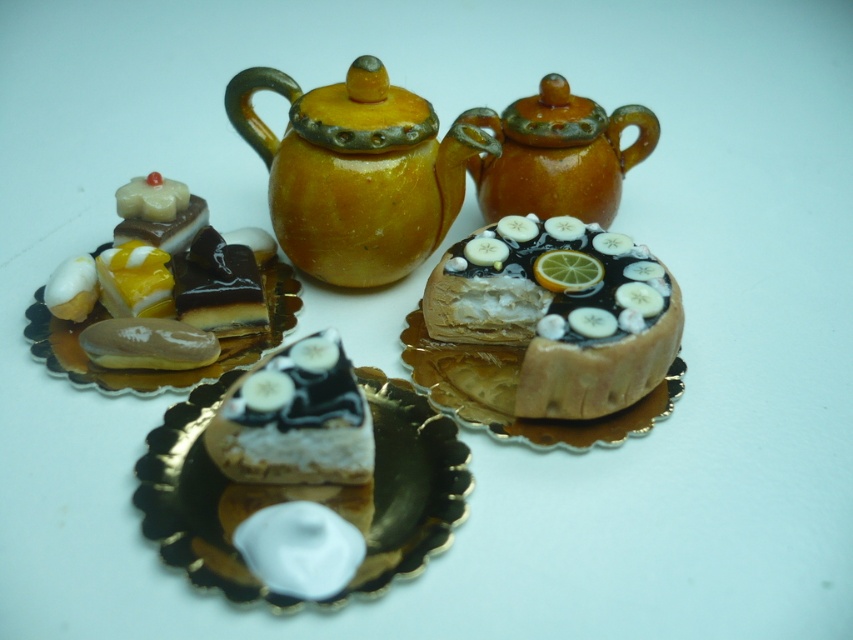
Question: Is glossy ceramic teapot at upper center positioned before semi-glossy chocolate bar at left?

Choices:
 (A) no
 (B) yes

Answer: (A)

Question: Which object appears farthest from the camera in this image?

Choices:
 (A) glossy ceramic teapot at upper center
 (B) matte orange teapot at upper center
 (C) semi-glossy chocolate bar at left

Answer: (B)

Question: Does chocolate glazed cake at center appear under white glossy cake at center?

Choices:
 (A) yes
 (B) no

Answer: (B)

Question: Estimate the real-world distances between objects in this image. Which object is closer to the chocolate glazed cake at center?

Choices:
 (A) white glossy cake at center
 (B) glossy ceramic teapot at upper center
 (C) matte orange teapot at upper center
 (D) white cream textured cake at center

Answer: (B)

Question: Can you confirm if glossy ceramic teapot at upper center is positioned to the left of white cream textured cake at center?

Choices:
 (A) yes
 (B) no

Answer: (B)

Question: Which object is the farthest from the semi-glossy chocolate bar at left?

Choices:
 (A) matte orange teapot at upper center
 (B) white glossy cake at center

Answer: (A)